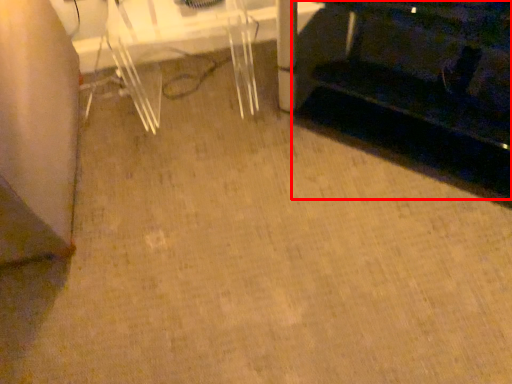
Question: Where is furniture (annotated by the red box) located in relation to table in the image?

Choices:
 (A) right
 (B) left

Answer: (A)